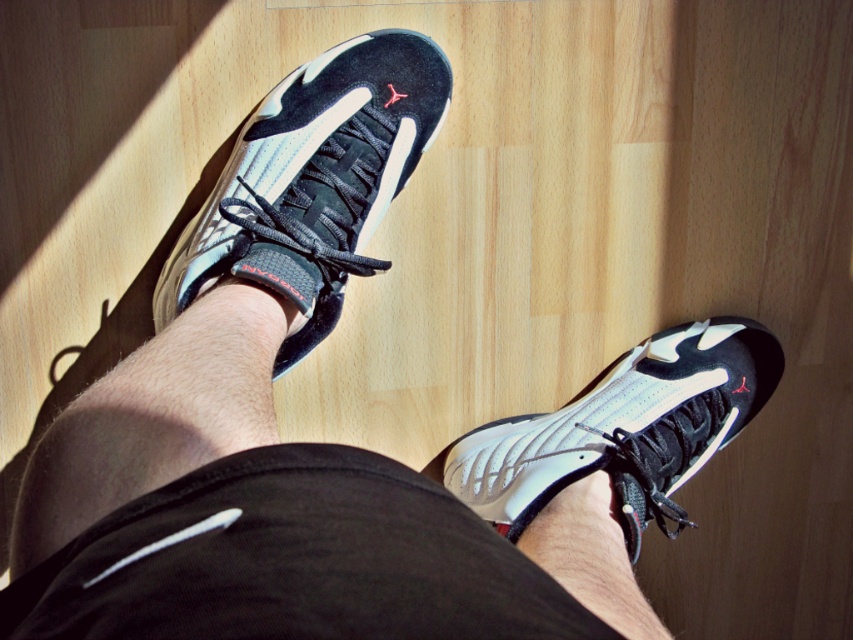
Does point (390, 152) lie in front of point (682, 512)?

Yes, point (390, 152) is in front of point (682, 512).

Can you confirm if white matte running shoe at center is taller than white matte sneaker at lower right?

Yes.

Find the location of a particular element. white matte running shoe at center is located at coordinates (314, 180).